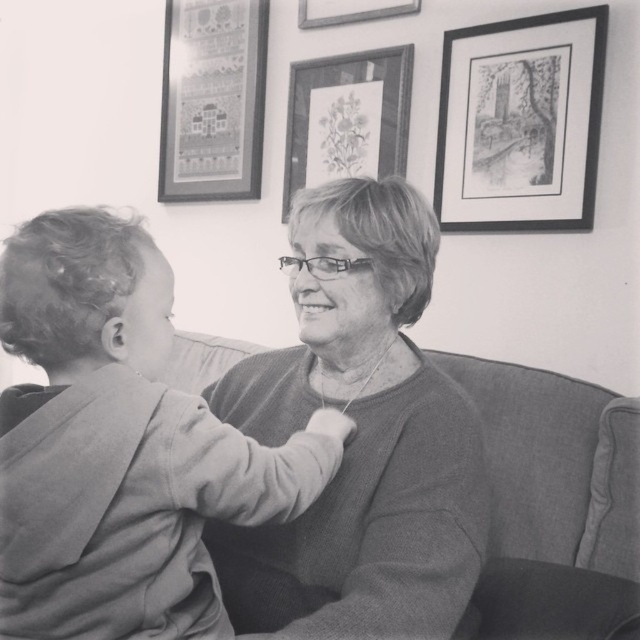
Can you confirm if textured fabric couch at center is taller than metallic silver picture frame at upper center?

Yes, textured fabric couch at center is taller than metallic silver picture frame at upper center.

Find the location of `textured fabric couch at center`. textured fabric couch at center is located at coordinates (554, 500).

This screenshot has height=640, width=640. Describe the element at coordinates (520, 122) in the screenshot. I see `black paper picture frame at upper right` at that location.

Is point (540, 189) positioned after point (221, 68)?

No, it is not.

Identify the location of black paper picture frame at upper right. Image resolution: width=640 pixels, height=640 pixels. (520, 122).

Does textured fabric couch at center appear over matte paper picture frame at upper center?

Incorrect, textured fabric couch at center is not positioned above matte paper picture frame at upper center.

Image resolution: width=640 pixels, height=640 pixels. Describe the element at coordinates (554, 500) in the screenshot. I see `textured fabric couch at center` at that location.

Find the location of a particular element. textured fabric couch at center is located at coordinates (554, 500).